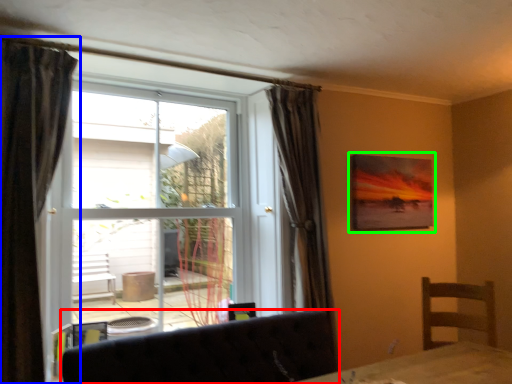
Question: Which object is positioned closest to furniture (highlighted by a red box)? Select from curtain (highlighted by a blue box) and picture frame (highlighted by a green box).

Choices:
 (A) curtain
 (B) picture frame

Answer: (A)